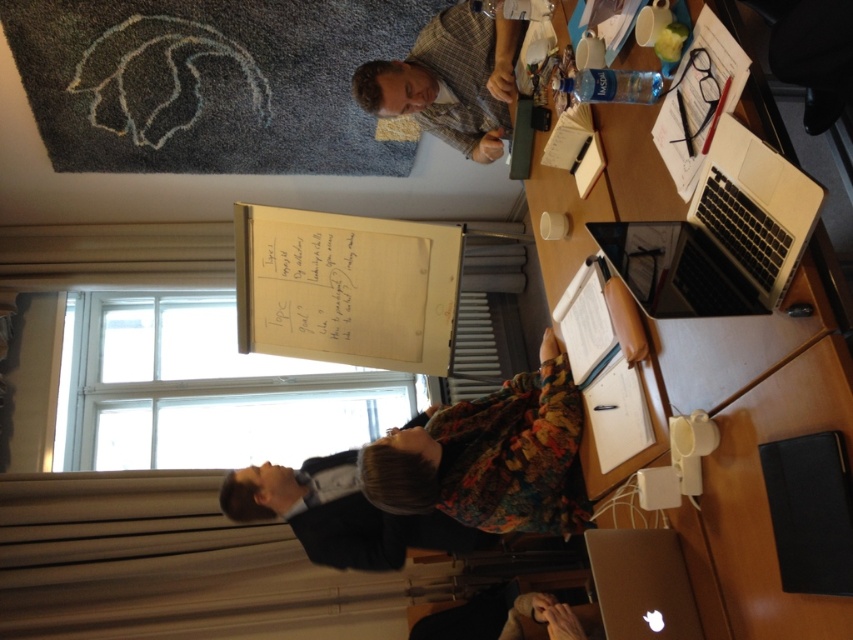
Question: Which object is the farthest from the silver metallic laptop at upper right?

Choices:
 (A) white paperboard at center
 (B) silver metallic laptop at lower right

Answer: (A)

Question: Can you confirm if white paperboard at center is wider than silver metallic laptop at upper right?

Choices:
 (A) no
 (B) yes

Answer: (B)

Question: Which point appears closest to the camera in this image?

Choices:
 (A) (788, 612)
 (B) (506, 452)
 (C) (383, 349)
 (D) (410, 92)

Answer: (A)

Question: Is white paper at upper center above plaid fabric shirt at upper center?

Choices:
 (A) yes
 (B) no

Answer: (B)

Question: Which object is the farthest from the silver metallic laptop at lower right?

Choices:
 (A) plaid fabric shirt at upper center
 (B) white paper at upper center
 (C) floral fabric dress at lower center
 (D) white paperboard at center

Answer: (D)

Question: Does white paperboard at center have a smaller size compared to floral fabric dress at lower center?

Choices:
 (A) yes
 (B) no

Answer: (B)